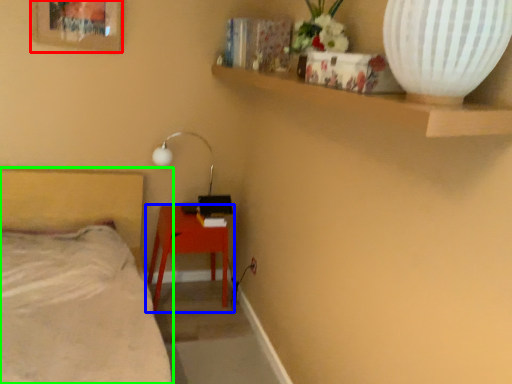
Question: Estimate the real-world distances between objects in this image. Which object is farther from picture frame (highlighted by a red box), table (highlighted by a blue box) or bed (highlighted by a green box)?

Choices:
 (A) table
 (B) bed

Answer: (A)